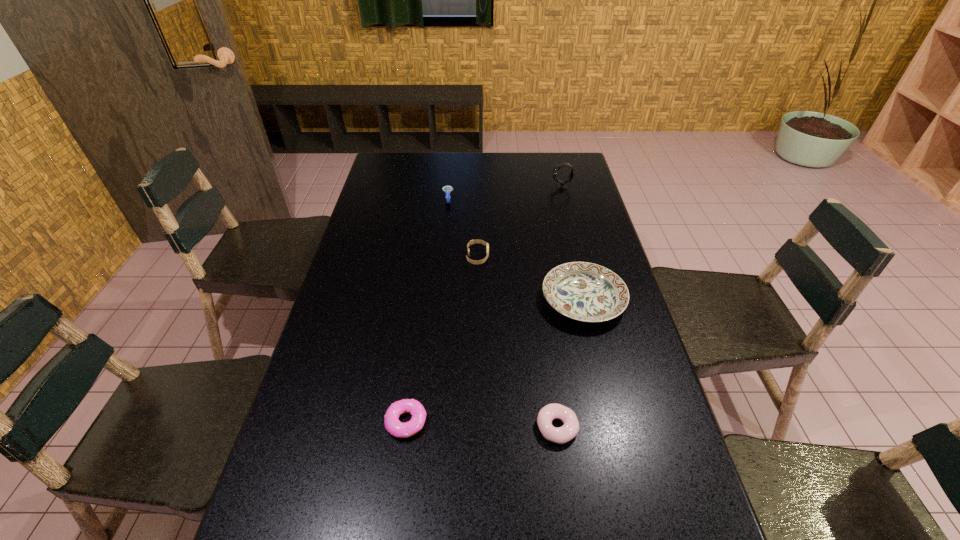
This screenshot has height=540, width=960. What are the coordinates of `the tallest watch` in the screenshot? It's located at (561, 184).

Where is `the farthest watch`? the farthest watch is located at coordinates (561, 184).

At what (x,y) coordinates should I click in order to perform the action: click on the second farthest object. Please return your answer as a coordinate pair (x, y). This screenshot has height=540, width=960. Looking at the image, I should click on (447, 189).

I want to click on the second nearest watch, so click(x=447, y=189).

Find the location of a particular element. This screenshot has height=540, width=960. the fourth nearest object is located at coordinates (471, 242).

In order to click on the nearest watch in this screenshot , I will do `click(471, 242)`.

Image resolution: width=960 pixels, height=540 pixels. Find the location of `the fourth farthest object`. the fourth farthest object is located at coordinates (587, 292).

In order to click on the right doughnut in this screenshot , I will do `click(560, 435)`.

The image size is (960, 540). Find the location of `the left doughnut`. the left doughnut is located at coordinates (392, 424).

Where is `free point located on the face of the rightmost watch`? This screenshot has height=540, width=960. free point located on the face of the rightmost watch is located at coordinates (454, 187).